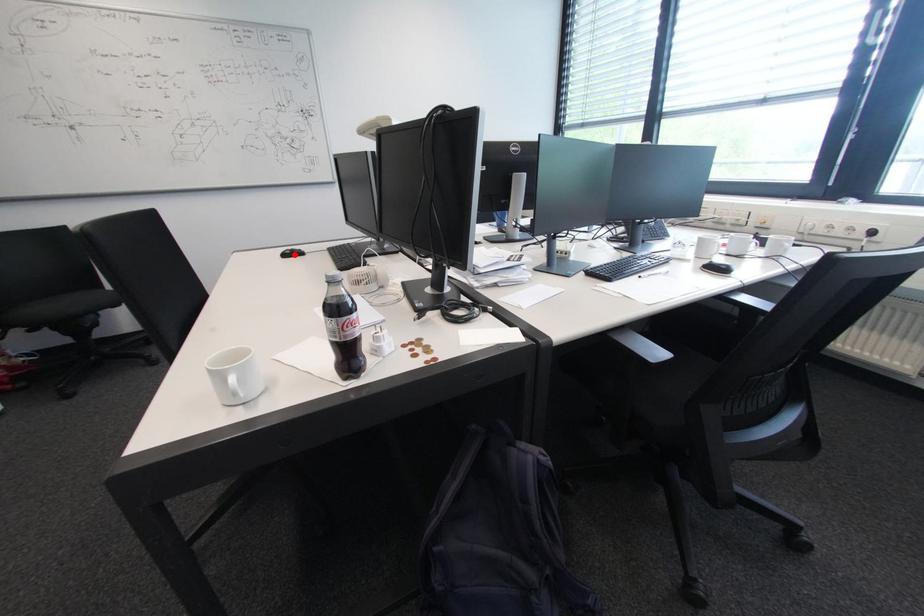
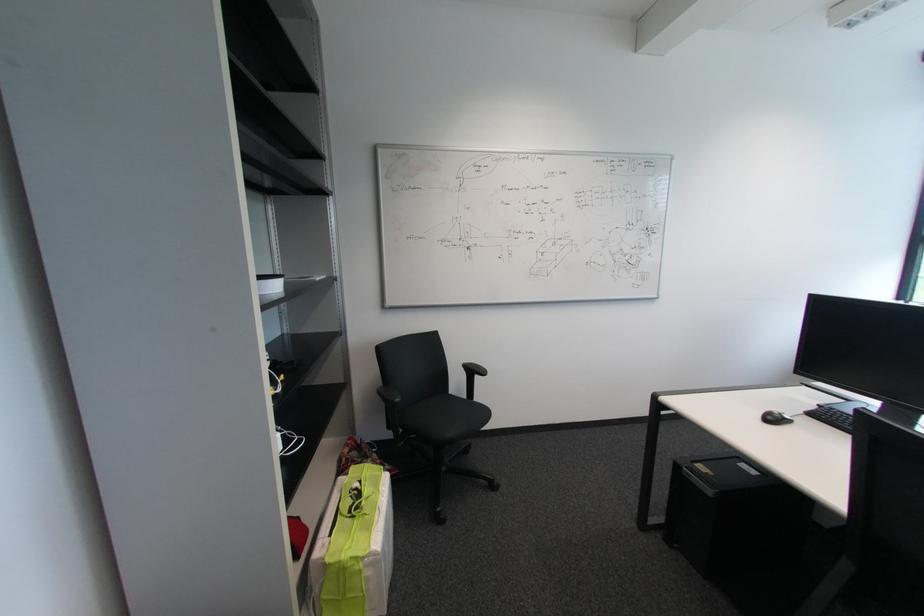
Where in the second image is the point corresponding to the highlighted location from the first image?

(775, 418)